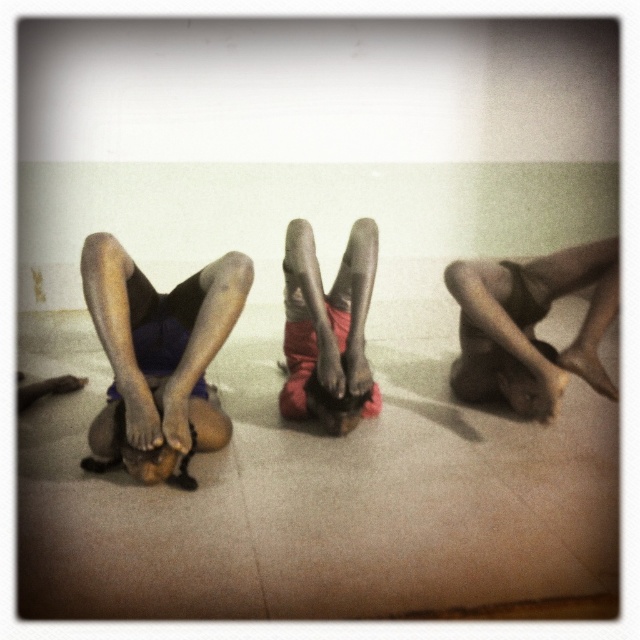
Can you confirm if dark skin legs at center is thinner than smooth skin legs at center?

Correct, dark skin legs at center's width is less than smooth skin legs at center's.

Which is in front, point (140, 419) or point (528, 397)?

Positioned in front is point (140, 419).

You are a GUI agent. You are given a task and a screenshot of the screen. Output one action in this format:
    pyautogui.click(x=<x>, y=<y>)
    Task: Click on the dark skin legs at center
    Image resolution: width=640 pixels, height=640 pixels.
    Given the screenshot: What is the action you would take?
    pyautogui.click(x=160, y=348)